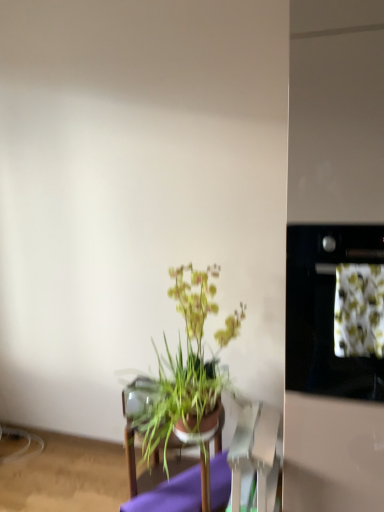
Question: Considering the relative positions of green leafy plant at center and green leafy plant at center in the image provided, is green leafy plant at center in front of green leafy plant at center?

Choices:
 (A) no
 (B) yes

Answer: (B)

Question: Can you confirm if green leafy plant at center is positioned to the left of green leafy plant at center?

Choices:
 (A) yes
 (B) no

Answer: (B)

Question: Is green leafy plant at center oriented towards green leafy plant at center?

Choices:
 (A) yes
 (B) no

Answer: (B)

Question: Can you confirm if green leafy plant at center is wider than green leafy plant at center?

Choices:
 (A) yes
 (B) no

Answer: (B)

Question: From a real-world perspective, is green leafy plant at center physically below green leafy plant at center?

Choices:
 (A) yes
 (B) no

Answer: (B)

Question: In terms of size, does green leafy plant at center appear bigger or smaller than stainless steel oven at right?

Choices:
 (A) big
 (B) small

Answer: (B)

Question: From a real-world perspective, is green leafy plant at center positioned above or below stainless steel oven at right?

Choices:
 (A) below
 (B) above

Answer: (B)

Question: From the image's perspective, is green leafy plant at center positioned above or below stainless steel oven at right?

Choices:
 (A) above
 (B) below

Answer: (B)

Question: Is point (357, 305) closer or farther from the camera than point (301, 343)?

Choices:
 (A) closer
 (B) farther

Answer: (A)

Question: From a real-world perspective, is green leafy plant at center above or below green leafy plant at center?

Choices:
 (A) above
 (B) below

Answer: (B)

Question: Is point (226, 460) positioned closer to the camera than point (339, 267)?

Choices:
 (A) closer
 (B) farther

Answer: (B)

Question: In terms of width, does green leafy plant at center look wider or thinner when compared to green leafy plant at center?

Choices:
 (A) wide
 (B) thin

Answer: (A)

Question: In the image, is green leafy plant at center positioned in front of or behind green leafy plant at center?

Choices:
 (A) front
 (B) behind

Answer: (B)

Question: Considering their positions, is stainless steel oven at right located in front of or behind green leafy plant at center?

Choices:
 (A) behind
 (B) front

Answer: (B)

Question: In terms of height, does stainless steel oven at right look taller or shorter compared to green leafy plant at center?

Choices:
 (A) tall
 (B) short

Answer: (A)